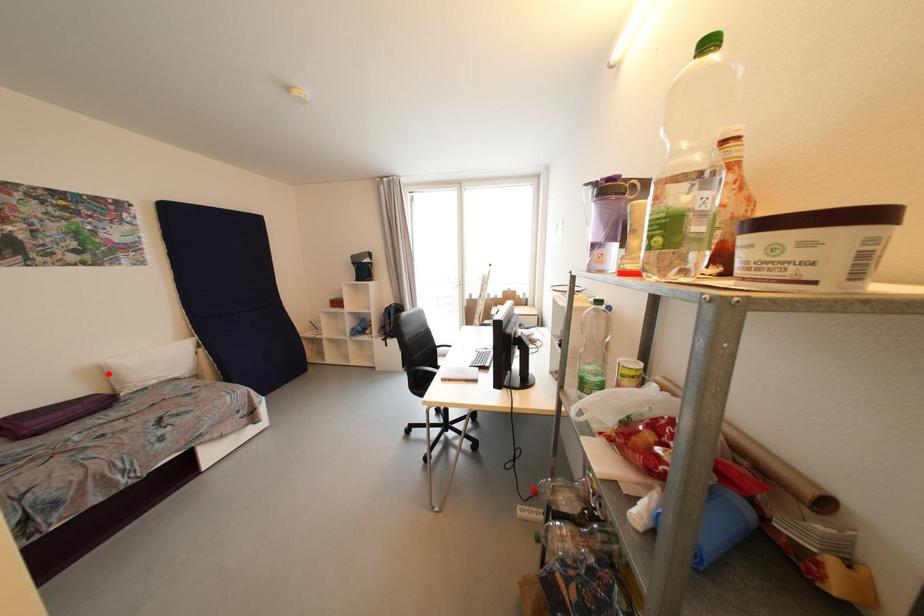
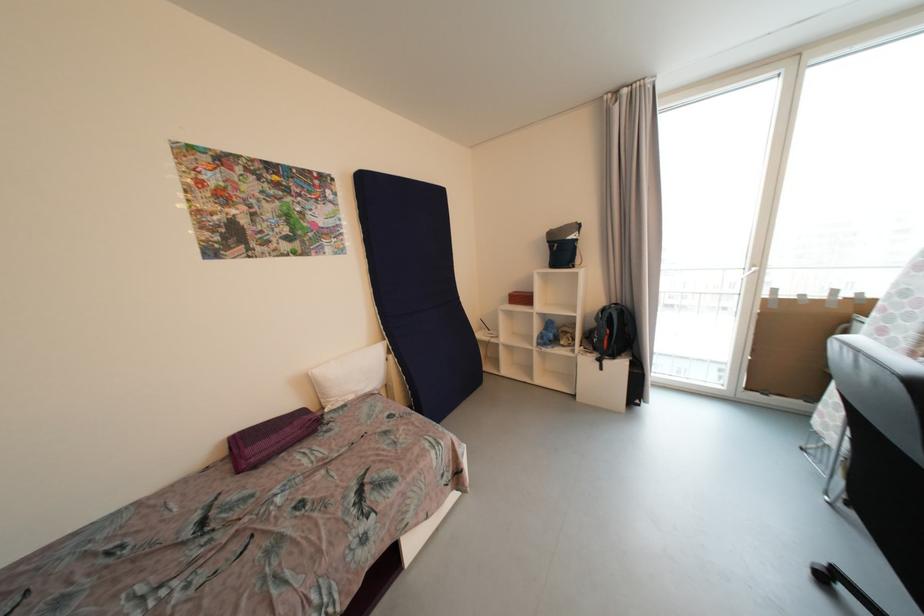
Question: A red point is marked in image1. In image2, is the corresponding 3D point closer to the camera or farther? Reply with the corresponding letter.

Choices:
 (A) The corresponding 3D point is closer.
 (B) The corresponding 3D point is farther.

Answer: (B)